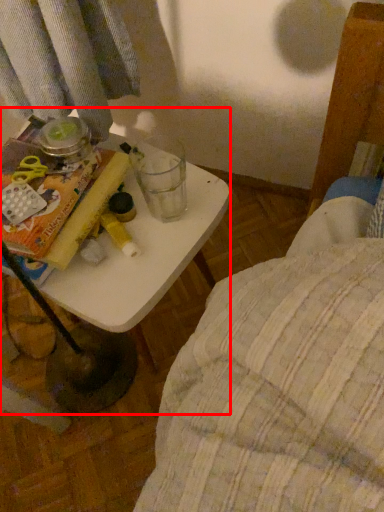
Question: Observing the image, what is the correct spatial positioning of table (annotated by the red box) in reference to paperback book?

Choices:
 (A) right
 (B) left

Answer: (A)